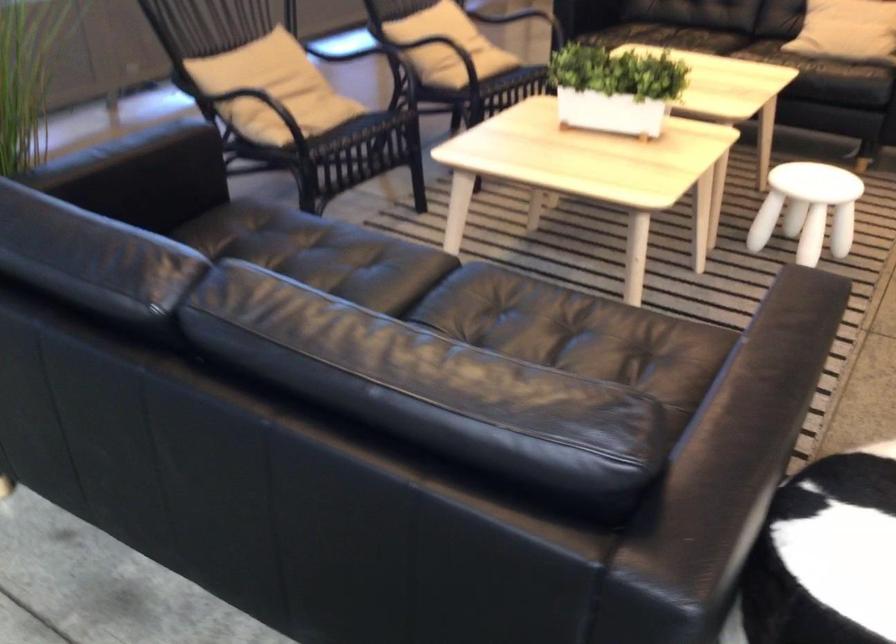
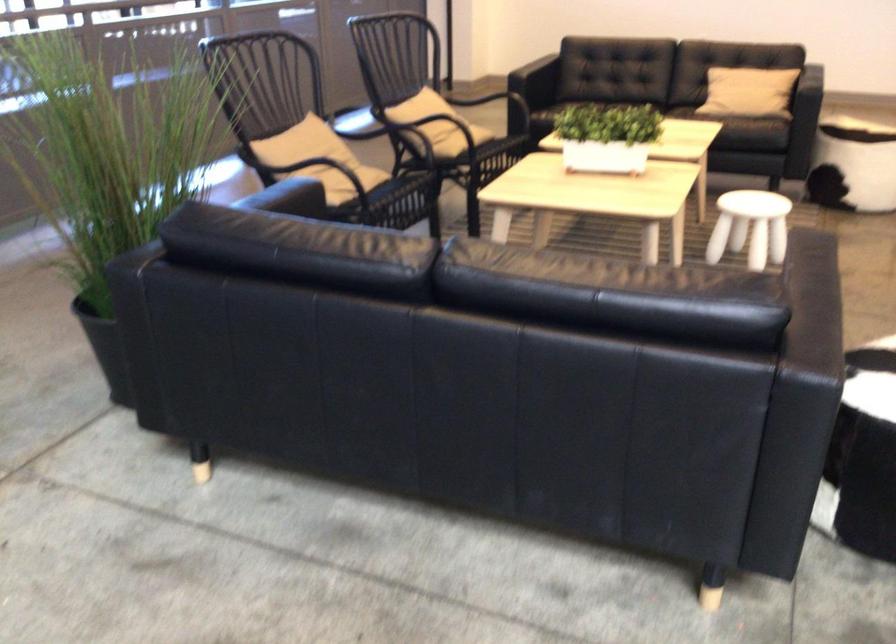
Where in the second image is the point corresponding to the point at 823,67 from the first image?

(745, 120)